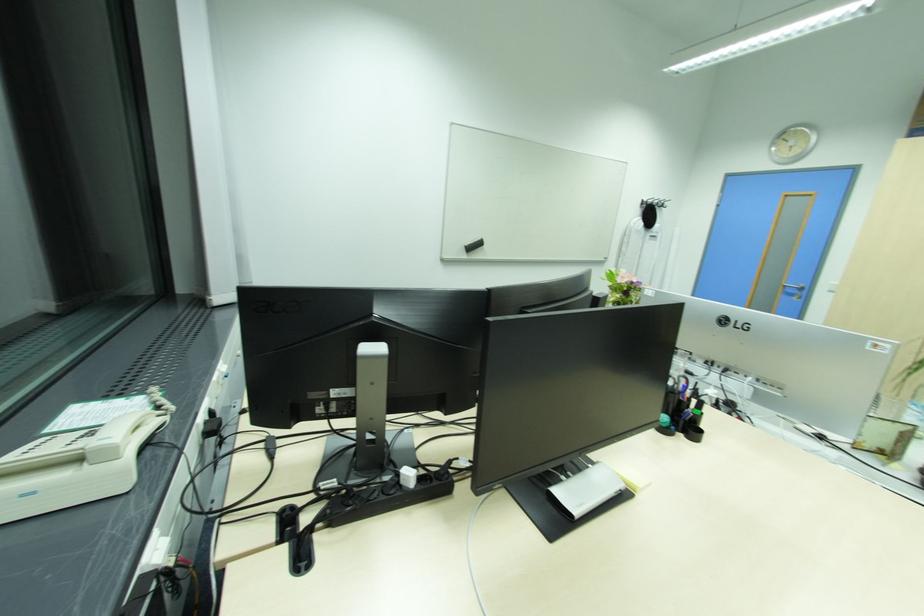
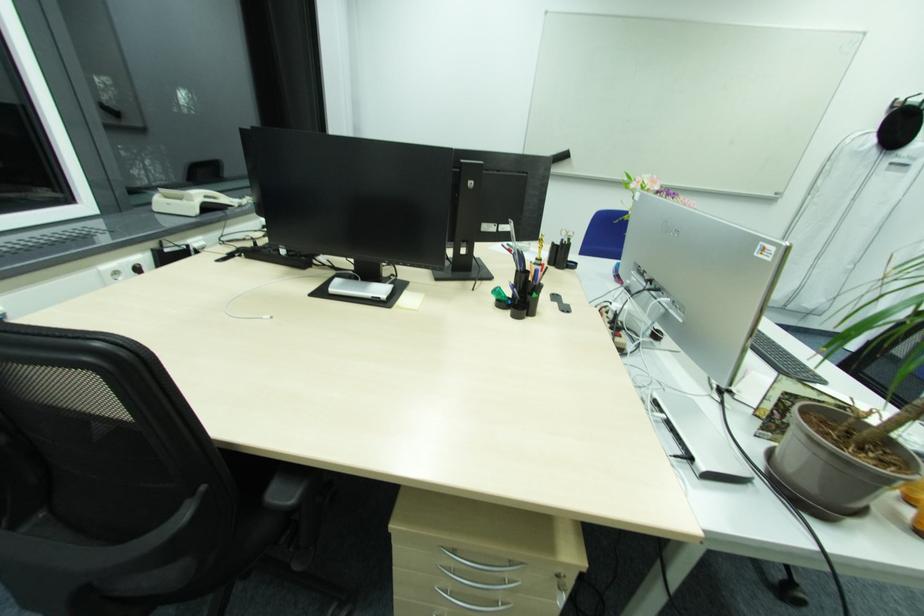
In the second image, find the point that corresponds to point (30, 493) in the first image.

(174, 205)